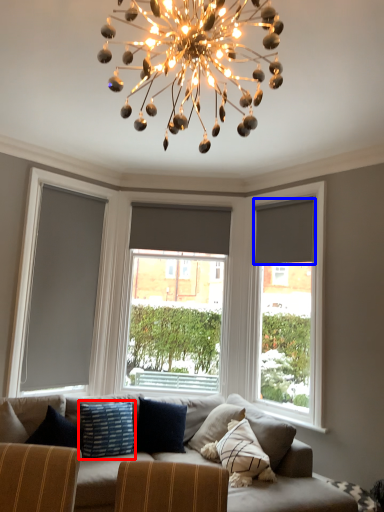
Question: Which point is further to the camera, pillow (highlighted by a red box) or curtain (highlighted by a blue box)?

Choices:
 (A) pillow
 (B) curtain

Answer: (B)